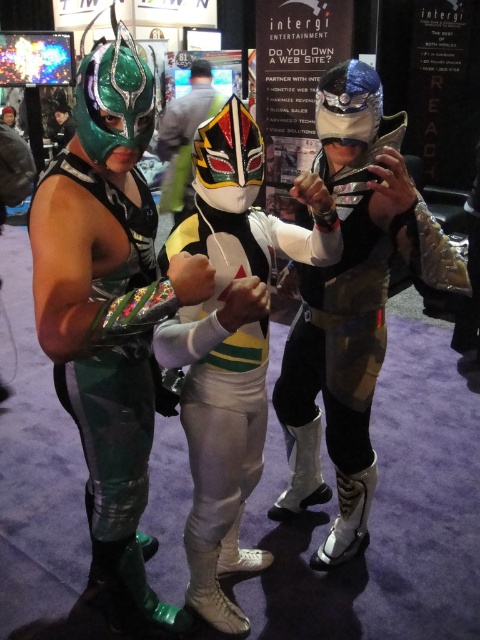
Question: Can you confirm if shiny silver armor at center is positioned to the right of green shiny suit at left?

Choices:
 (A) no
 (B) yes

Answer: (B)

Question: Does shiny silver armor at center have a larger size compared to green shiny suit at left?

Choices:
 (A) yes
 (B) no

Answer: (A)

Question: Which of the following is the farthest from the observer?

Choices:
 (A) white glossy mask at center
 (B) green shiny suit at left

Answer: (A)

Question: Among these points, which one is nearest to the camera?

Choices:
 (A) (175, 109)
 (B) (321, 269)
 (C) (95, 461)
 (D) (208, 202)

Answer: (D)

Question: Does shiny silver armor at center appear on the right side of green shiny suit at left?

Choices:
 (A) no
 (B) yes

Answer: (B)

Question: Which object is closer to the camera taking this photo?

Choices:
 (A) green shiny suit at left
 (B) shiny silver armor at center
 (C) white glossy mask at center
 (D) white matte costume at center

Answer: (A)